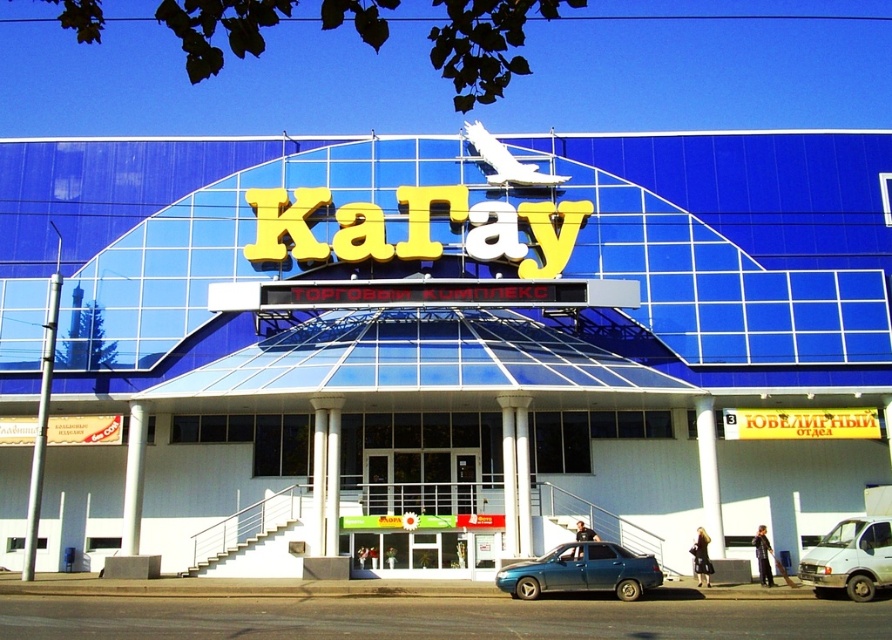
You are a pedestrian standing at the entrance of the shopping center. You see the blue glass building at center and the metallic blue sedan at center. Which one is higher from the ground?

The blue glass building at center is located above the metallic blue sedan at center, so the blue glass building at center is higher from the ground.

You are a delivery driver arriving at the shopping center. You need to park your vehicle but there is only space for one more car. Which vehicle, the metallic blue sedan at center or the white matte van at lower right, is closer to the entrance?

The metallic blue sedan at center is closer to the entrance because it is in front of the white matte van at lower right, meaning it is positioned nearer to the entrance area.